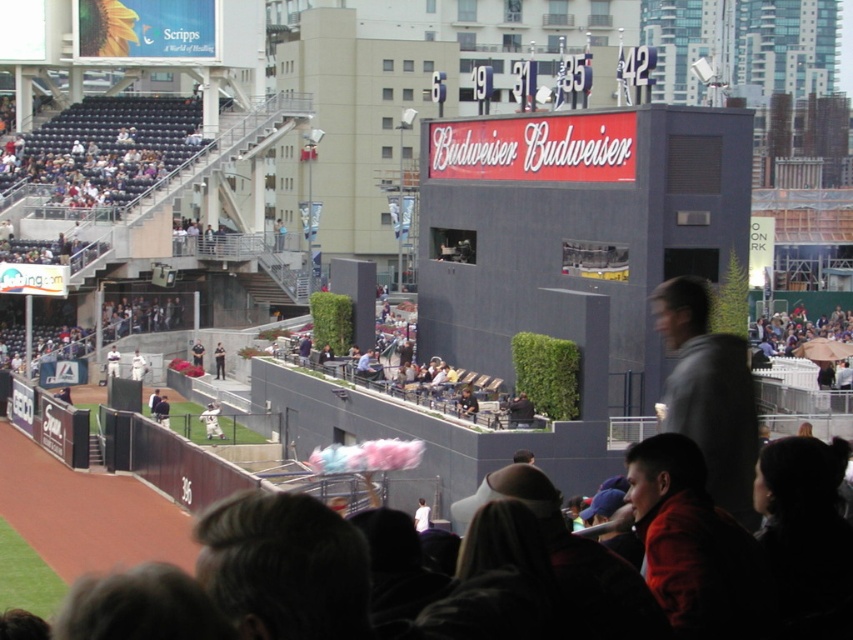
In the scene shown: You are a photographer trying to capture a closeup of the white jersey at center and the white baseball glove at center from the stands. Since both are at the center, which one will appear larger in your photo?

The white jersey at center will appear larger in the photo because it is bigger than the white baseball glove at center.

You are a photographer standing at the center of the baseball stadium. You want to take a photo that includes both the point at coordinates point [119,356] and point [223,355]. Which point should you focus on first to ensure both are in focus?

You should focus on point [119,356] first because it is closer to the camera than point [223,355], ensuring both points are within the depth of field.

You are standing at the point labeled point (204, 424) in the baseball stadium. You want to throw a baseball to your friend who is exactly 80 meters away from you. Can you reach them with a single throw?

The distance between you and your friend is 80 meters, but the maximum throwing distance in a baseball stadium is typically around 78.44 meters. Therefore, you cannot reach your friend with a single throw.